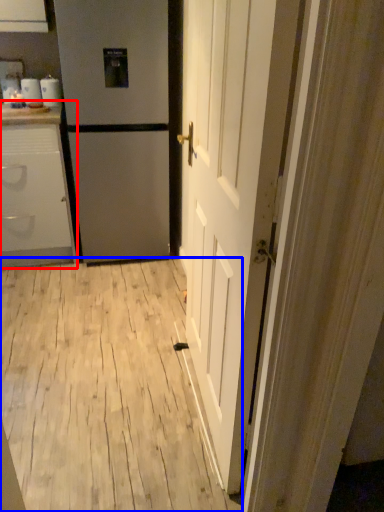
Question: Which object is further to the camera taking this photo, cabinetry (highlighted by a red box) or plywood (highlighted by a blue box)?

Choices:
 (A) cabinetry
 (B) plywood

Answer: (A)